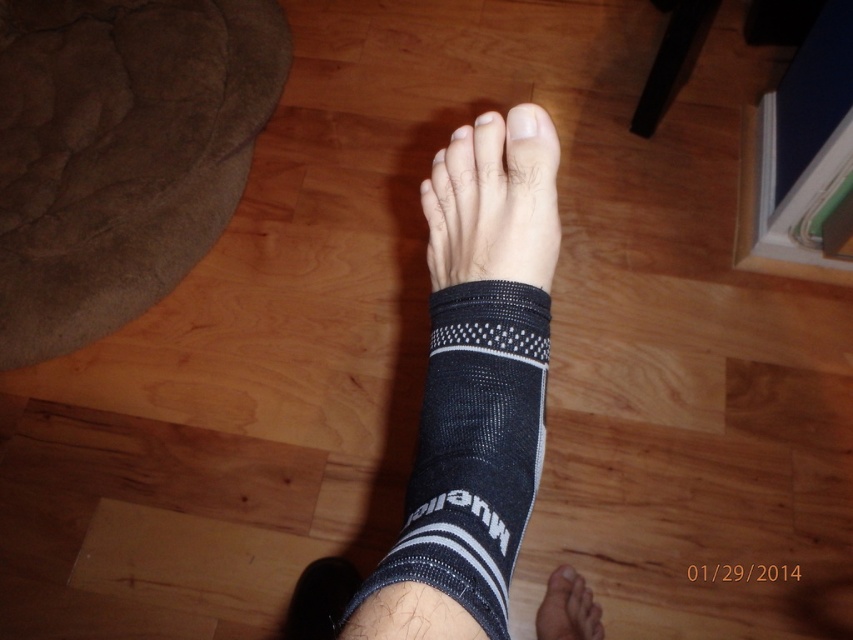
You are standing in front of the wooden floor and see two points marked on it. Which point is closer to you, point (512,216) or point (556,609)?

Point (512,216) is closer to the viewer than point (556,609).

You are a physical therapist examining a patient. You notice the white matte nail at center and the white matte toe at center. Which one is closer to you?

The white matte nail at center is closer to you than the white matte toe at center.